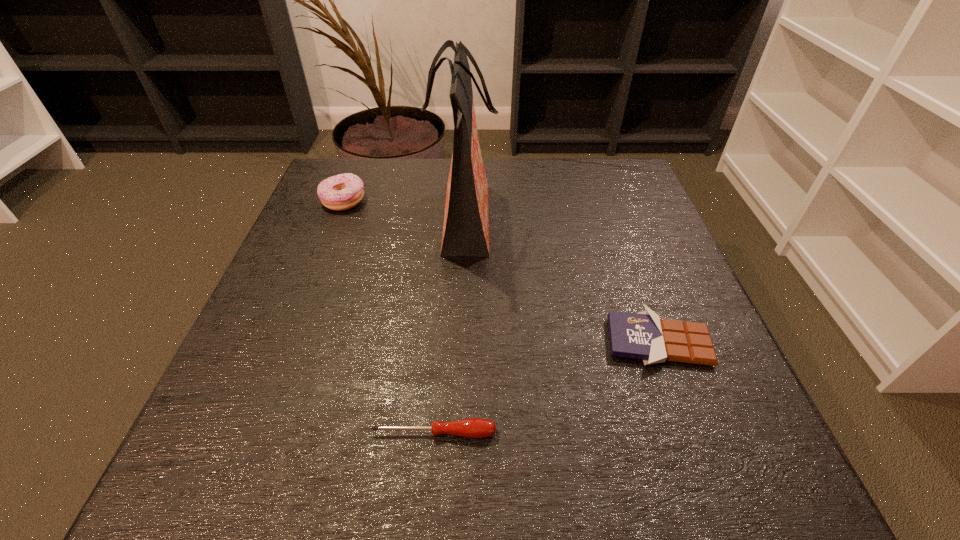
Find the location of a particular element. Image resolution: width=960 pixels, height=540 pixels. the tallest object is located at coordinates (466, 219).

Locate an element on the screen. The width and height of the screenshot is (960, 540). doughnut is located at coordinates (340, 192).

This screenshot has height=540, width=960. What are the coordinates of `the third shortest object` in the screenshot? It's located at click(340, 192).

Where is `chocolate bar`? The image size is (960, 540). chocolate bar is located at coordinates (642, 335).

The height and width of the screenshot is (540, 960). What are the coordinates of `the second nearest object` in the screenshot? It's located at (642, 335).

Find the location of a particular element. The image size is (960, 540). the nearest object is located at coordinates point(473,427).

Locate an element on the screen. The height and width of the screenshot is (540, 960). vacant space situated 0.160m on the front side of the shopping bag is located at coordinates (567, 222).

The image size is (960, 540). I want to click on free region located on the right of the third shortest object, so click(420, 201).

Where is `vacant space positioned 0.390m on the back of the rightmost object`? vacant space positioned 0.390m on the back of the rightmost object is located at coordinates (605, 193).

Identify the location of free space located 0.160m on the right of the screwdriver. (607, 433).